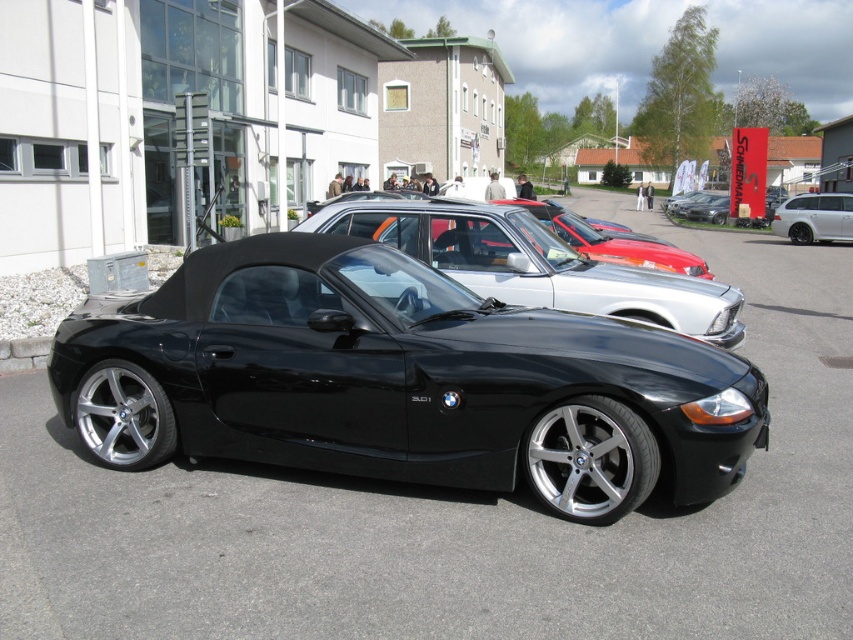
You are a delivery person who needs to move a 2.5 meter long crate between the black car at center and the silver metallic sedan at center. Can you fit the crate between them without tilting it?

The distance between the black car at center and the silver metallic sedan at center is 3.02 meters. Since the crate is 2.5 meters long, it can fit between them as the space is wider than the crate.

You are a parking attendant who needs to fit both the black car at center and the silver metallic sedan at center into a parking space that is exactly 2 meters wide. Based on their widths, can both cars fit side by side in the space?

The black car at center is wider than the silver metallic sedan at center. Since the parking space is only 2 meters wide, and the combined width of both cars exceeds this measurement, they cannot fit side by side in the space.